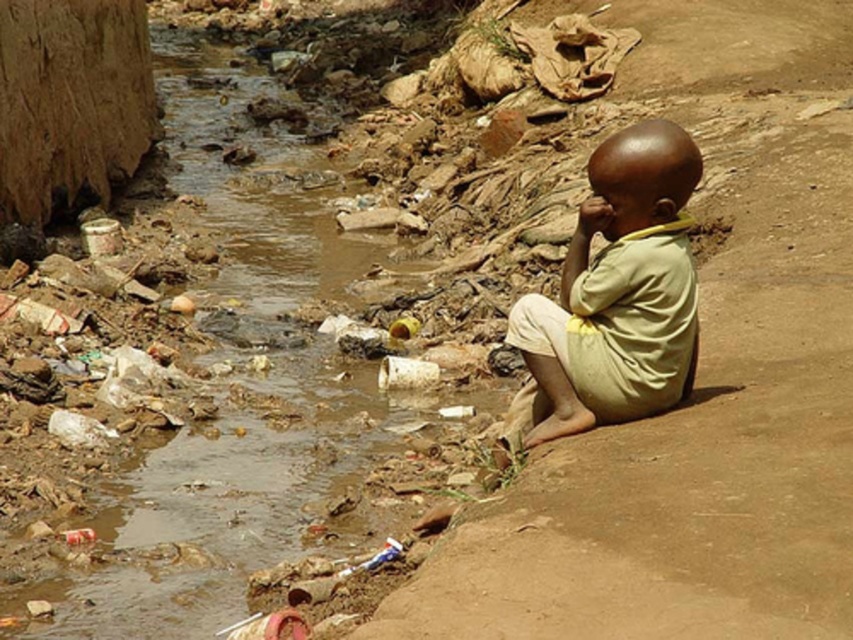
You are a sanitation worker who needs to clean up the area. You see the brown dirt stream at lower left and the light yellow fabric at right. Which object should you prioritize cleaning first if you want to address the larger problem first?

The brown dirt stream at lower left should be prioritized because its width is larger than the light yellow fabric at right, indicating a more significant issue requiring immediate attention.

You are a photographer who wants to capture the brown dirt stream at lower left and the light yellow fabric at right in the same frame. Based on their sizes in the image, which object will appear larger in the photo?

The brown dirt stream at lower left is much taller than the light yellow fabric at right, so it will appear larger in the photo.

You are a drone operator trying to capture a clear image of the brown dirt stream at lower left. The drone is currently positioned at point A. To ensure the stream is in the center of the photo, should you move the drone left or right?

The brown dirt stream at lower left is located at point (218,508). Since the stream is at lower left, moving the drone to the right would center it in the photo.